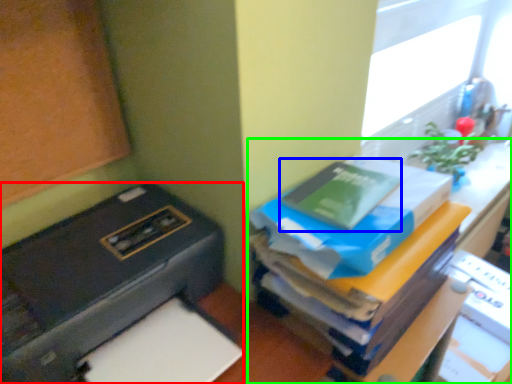
Question: Which object is the closest to the printer (highlighted by a red box)? Choose among these: paperback book (highlighted by a blue box) or furniture (highlighted by a green box).

Choices:
 (A) paperback book
 (B) furniture

Answer: (B)